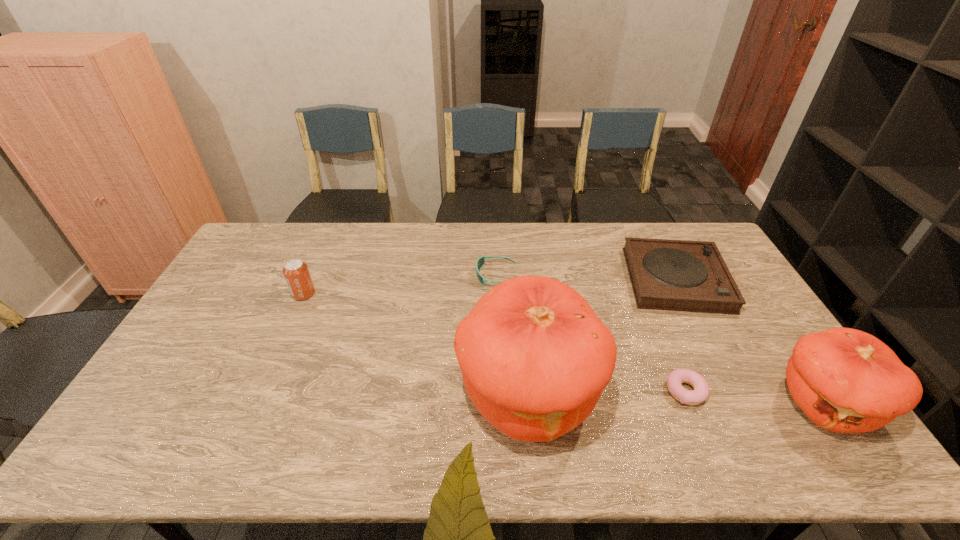
With all pumpkins evenly spaced, where should an extra pumpkin be placed on the left to continue the pattern? Please point out a vacant space. Please provide its 2D coordinates. Your answer should be formatted as a tuple, i.e. [(x, y)], where the tuple contains the x and y coordinates of a point satisfying the conditions above.

[(243, 384)]